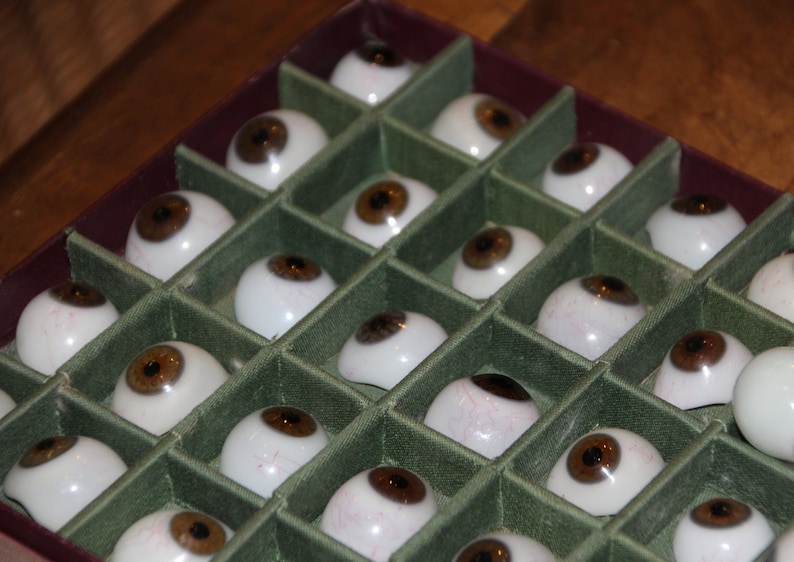
Locate an element on the screen. hardwood floor top left of box of eyes is located at coordinates (102, 99).